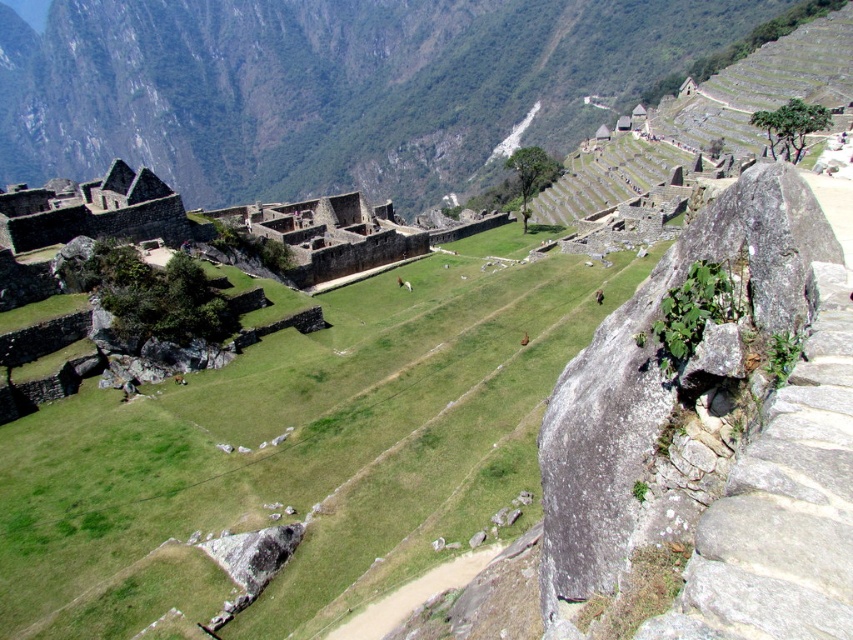
Question: Among these objects, which one is farthest from the camera?

Choices:
 (A) green grassy field at center
 (B) green grassy at center

Answer: (A)

Question: Which point is farther to the camera?

Choices:
 (A) (363, 179)
 (B) (427, 563)

Answer: (A)

Question: Does green grassy at center appear on the right side of green grassy field at center?

Choices:
 (A) yes
 (B) no

Answer: (A)

Question: Can you confirm if green grassy at center is bigger than green grassy field at center?

Choices:
 (A) no
 (B) yes

Answer: (A)

Question: Which object is closer to the camera taking this photo?

Choices:
 (A) green grassy at center
 (B) green grassy field at center

Answer: (A)

Question: Observing the image, what is the correct spatial positioning of green grassy at center in reference to green grassy field at center?

Choices:
 (A) above
 (B) below

Answer: (B)